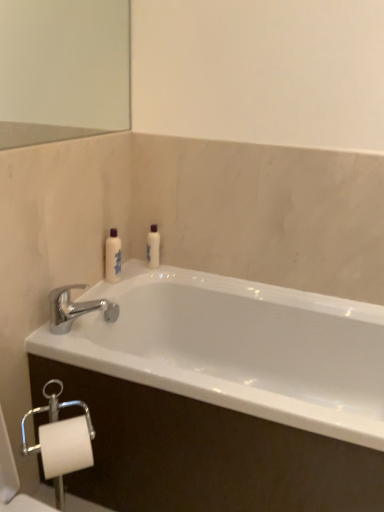
Consider the image. Measure the distance between white glossy lotion at center, positioned as the 2th toiletry in left-to-right order, and camera.

white glossy lotion at center, positioned as the 2th toiletry in left-to-right order, is 1.74 meters away from camera.

Where is `white glossy lotion at center, the first toiletry positioned from the back`? The width and height of the screenshot is (384, 512). white glossy lotion at center, the first toiletry positioned from the back is located at coordinates (153, 247).

Find the location of a particular element. The height and width of the screenshot is (512, 384). white glossy bathtub at center is located at coordinates (237, 348).

Where is `white glossy lotion at center, the first toiletry positioned from the back`? Image resolution: width=384 pixels, height=512 pixels. white glossy lotion at center, the first toiletry positioned from the back is located at coordinates (153, 247).

Considering the relative positions of white glossy bathtub at center and white glossy bottle at upper left, which is counted as the first toiletry, starting from the front, in the image provided, is white glossy bathtub at center behind white glossy bottle at upper left, which is counted as the first toiletry, starting from the front,?

That is False.

Between white glossy bathtub at center and white glossy bottle at upper left, which is counted as the first toiletry, starting from the front, which one has less height?

white glossy bottle at upper left, which is counted as the first toiletry, starting from the front.

Is white glossy bathtub at center turned away from white glossy bottle at upper left, the second toiletry when ordered from back to front?

No, white glossy bottle at upper left, the second toiletry when ordered from back to front, is not at the back of white glossy bathtub at center.

Would you consider white glossy bathtub at center to be distant from white glossy bottle at upper left, which ranks as the 1th toiletry in left-to-right order?

white glossy bathtub at center is near white glossy bottle at upper left, which ranks as the 1th toiletry in left-to-right order, not far away.

Would you consider white glossy bottle at upper left, placed as the 2th toiletry when sorted from right to left, to be distant from white glossy bathtub at center?

That's not correct — white glossy bottle at upper left, placed as the 2th toiletry when sorted from right to left, is a little close to white glossy bathtub at center.

Which object is thinner, white glossy bottle at upper left, the second toiletry when ordered from back to front, or white glossy bathtub at center?

With smaller width is white glossy bottle at upper left, the second toiletry when ordered from back to front.

Does white glossy bottle at upper left, placed as the 2th toiletry when sorted from right to left, have a larger size compared to white glossy bathtub at center?

Incorrect, white glossy bottle at upper left, placed as the 2th toiletry when sorted from right to left, is not larger than white glossy bathtub at center.

From the picture: Which object is closer to the camera taking this photo, white glossy bottle at upper left, the second toiletry when ordered from back to front, or white glossy bathtub at center?

white glossy bathtub at center is in front.

From the image's perspective, would you say chrome metallic faucet at upper left is positioned over white glossy bathtub at center?

Yes.

Which of these two, chrome metallic faucet at upper left or white glossy bathtub at center, stands taller?

With more height is white glossy bathtub at center.

Is chrome metallic faucet at upper left turned away from white glossy bathtub at center?

No.

Which object is positioned more to the left, chrome metallic faucet at upper left or white glossy bathtub at center?

chrome metallic faucet at upper left is more to the left.

From the image's perspective, is white glossy lotion at center, the 1th toiletry viewed from the right, above white glossy bottle at upper left, the second toiletry when ordered from back to front?

Yes.

I want to click on toiletry below the white glossy lotion at center, the 1th toiletry viewed from the right (from the image's perspective), so click(113, 257).

Between white glossy lotion at center, the 1th toiletry viewed from the right, and white glossy bottle at upper left, placed as the 2th toiletry when sorted from right to left, which one has larger size?

white glossy bottle at upper left, placed as the 2th toiletry when sorted from right to left, is bigger.

Is white glossy lotion at center, the 1th toiletry viewed from the right, closer to camera compared to white glossy bottle at upper left, which is counted as the first toiletry, starting from the front?

No, white glossy lotion at center, the 1th toiletry viewed from the right, is further to the viewer.

Is chrome metallic faucet at upper left looking in the opposite direction of white glossy lotion at center, the 1th toiletry viewed from the right?

No, white glossy lotion at center, the 1th toiletry viewed from the right, is not at the back of chrome metallic faucet at upper left.

How different are the orientations of chrome metallic faucet at upper left and white glossy lotion at center, the 1th toiletry viewed from the right, in degrees?

The angular difference between chrome metallic faucet at upper left and white glossy lotion at center, the 1th toiletry viewed from the right, is 86.6 degrees.

This screenshot has height=512, width=384. Identify the location of tap in front of the white glossy lotion at center, the 2th toiletry from the front. (75, 308).

Is white glossy lotion at center, positioned as the 2th toiletry in left-to-right order, completely or partially inside chrome metallic faucet at upper left?

Definitely not — white glossy lotion at center, positioned as the 2th toiletry in left-to-right order, is not inside chrome metallic faucet at upper left.

From the image's perspective, which is above, chrome metallic faucet at upper left or white glossy bottle at upper left, the second toiletry when ordered from back to front?

white glossy bottle at upper left, the second toiletry when ordered from back to front, from the image's perspective.

Considering the sizes of objects chrome metallic faucet at upper left and white glossy bottle at upper left, placed as the 2th toiletry when sorted from right to left, in the image provided, who is wider, chrome metallic faucet at upper left or white glossy bottle at upper left, placed as the 2th toiletry when sorted from right to left,?

chrome metallic faucet at upper left is wider.

Between chrome metallic faucet at upper left and white glossy bottle at upper left, which is counted as the first toiletry, starting from the front, which one appears on the right side from the viewer's perspective?

white glossy bottle at upper left, which is counted as the first toiletry, starting from the front, is more to the right.

From the image's perspective, which is above, white glossy lotion at center, the first toiletry positioned from the back, or chrome metallic faucet at upper left?

From the image's view, white glossy lotion at center, the first toiletry positioned from the back, is above.

From the chrome metallic faucet at upper left, count 2nd toiletry to the right and point to it. Please provide its 2D coordinates.

[(153, 247)]

Is white glossy lotion at center, the 1th toiletry viewed from the right, situated inside chrome metallic faucet at upper left or outside?

white glossy lotion at center, the 1th toiletry viewed from the right, cannot be found inside chrome metallic faucet at upper left.

Can you see white glossy lotion at center, the 2th toiletry from the front, touching chrome metallic faucet at upper left?

No, white glossy lotion at center, the 2th toiletry from the front, is not with chrome metallic faucet at upper left.

Image resolution: width=384 pixels, height=512 pixels. Find the location of `bathtub below the white glossy bottle at upper left, the second toiletry when ordered from back to front (from the image's perspective)`. bathtub below the white glossy bottle at upper left, the second toiletry when ordered from back to front (from the image's perspective) is located at coordinates (237, 348).

Locate an element on the screen. The width and height of the screenshot is (384, 512). bathtub in front of the white glossy bottle at upper left, placed as the 2th toiletry when sorted from right to left is located at coordinates point(237,348).

From the image, which object appears to be farther from white glossy bottle at upper left, which ranks as the 1th toiletry in left-to-right order, white glossy bathtub at center or chrome metallic faucet at upper left?

white glossy bathtub at center is further to white glossy bottle at upper left, which ranks as the 1th toiletry in left-to-right order.

Considering their positions, is white glossy lotion at center, the first toiletry positioned from the back, positioned further to chrome metallic faucet at upper left than white glossy bottle at upper left, placed as the 2th toiletry when sorted from right to left?

white glossy lotion at center, the first toiletry positioned from the back, is positioned further to the anchor chrome metallic faucet at upper left.

Consider the image. Looking at the image, which one is located further to white glossy bottle at upper left, which ranks as the 1th toiletry in left-to-right order, white glossy lotion at center, positioned as the 2th toiletry in left-to-right order, or white glossy bathtub at center?

The object further to white glossy bottle at upper left, which ranks as the 1th toiletry in left-to-right order, is white glossy bathtub at center.

Based on the photo, looking at the image, which one is located further to white glossy bottle at upper left, the second toiletry when ordered from back to front, chrome metallic faucet at upper left or white glossy bathtub at center?

white glossy bathtub at center lies further to white glossy bottle at upper left, the second toiletry when ordered from back to front, than the other object.

Estimate the real-world distances between objects in this image. Which object is closer to white glossy lotion at center, positioned as the 2th toiletry in left-to-right order, white glossy bottle at upper left, placed as the 2th toiletry when sorted from right to left, or white glossy bathtub at center?

white glossy bottle at upper left, placed as the 2th toiletry when sorted from right to left.

In the scene shown: Which object lies further to the anchor point chrome metallic faucet at upper left, white glossy bathtub at center or white glossy bottle at upper left, which ranks as the 1th toiletry in left-to-right order?

Based on the image, white glossy bathtub at center appears to be further to chrome metallic faucet at upper left.

Looking at the image, which one is located further to chrome metallic faucet at upper left, white glossy bottle at upper left, placed as the 2th toiletry when sorted from right to left, or white glossy lotion at center, the first toiletry positioned from the back?

Based on the image, white glossy lotion at center, the first toiletry positioned from the back, appears to be further to chrome metallic faucet at upper left.

Estimate the real-world distances between objects in this image. Which object is further from white glossy bottle at upper left, placed as the 2th toiletry when sorted from right to left, white glossy bathtub at center or white glossy lotion at center, the 1th toiletry viewed from the right?

white glossy bathtub at center is positioned further to the anchor white glossy bottle at upper left, placed as the 2th toiletry when sorted from right to left.

The height and width of the screenshot is (512, 384). What are the coordinates of `toiletry between white glossy bathtub at center and white glossy lotion at center, the first toiletry positioned from the back, from front to back` in the screenshot? It's located at (113, 257).

Identify the location of tap positioned between white glossy bathtub at center and white glossy lotion at center, the 2th toiletry from the front, from near to far. This screenshot has width=384, height=512. (75, 308).

Find the location of a particular element. The image size is (384, 512). tap located between white glossy bathtub at center and white glossy bottle at upper left, which ranks as the 1th toiletry in left-to-right order, in the depth direction is located at coordinates (75, 308).

The width and height of the screenshot is (384, 512). In order to click on toiletry between chrome metallic faucet at upper left and white glossy lotion at center, the 1th toiletry viewed from the right, in the front-back direction in this screenshot , I will do `click(113, 257)`.